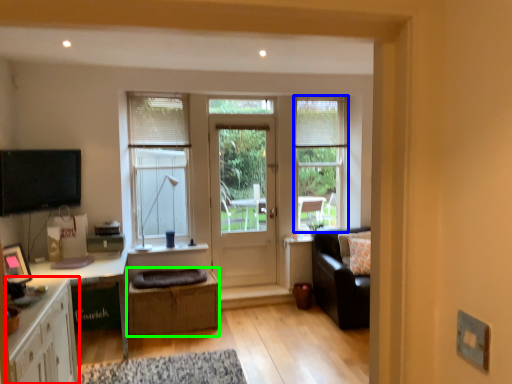
Question: Estimate the real-world distances between objects in this image. Which object is closer to cabinetry (highlighted by a red box), window (highlighted by a blue box) or crate (highlighted by a green box)?

Choices:
 (A) window
 (B) crate

Answer: (B)